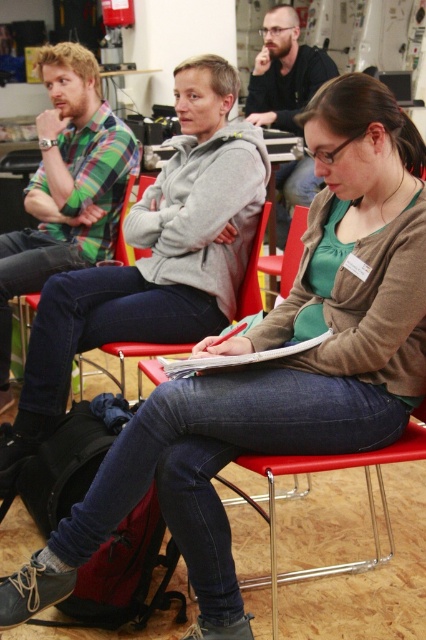
Question: Can you confirm if matte gray hoodie at center is positioned below matte black shirt at center?

Choices:
 (A) no
 (B) yes

Answer: (B)

Question: Which of the following is the farthest from the observer?

Choices:
 (A) matte gray hoodie at center
 (B) green plaid shirt at left

Answer: (B)

Question: Estimate the real-world distances between objects in this image. Which object is farther from the matte black shirt at center?

Choices:
 (A) green plaid shirt at left
 (B) matte gray hoodie at center

Answer: (B)

Question: Does green plaid shirt at left have a lesser width compared to matte black shirt at center?

Choices:
 (A) no
 (B) yes

Answer: (A)

Question: Among these objects, which one is nearest to the camera?

Choices:
 (A) matte black shirt at center
 (B) matte gray hoodie at center
 (C) green plaid shirt at left

Answer: (B)

Question: Is the position of matte gray hoodie at center more distant than that of green plaid shirt at left?

Choices:
 (A) no
 (B) yes

Answer: (A)